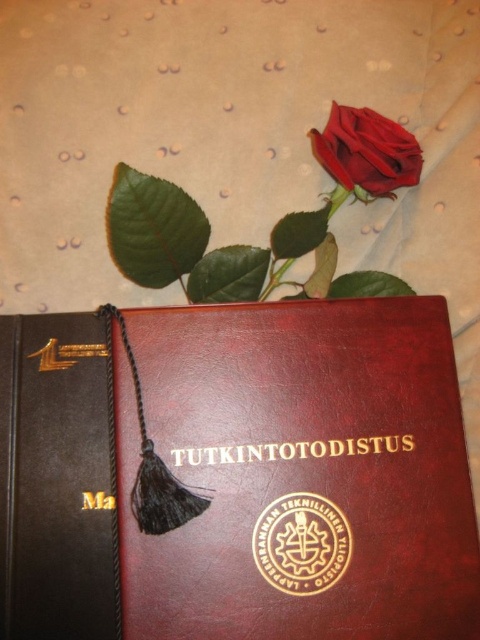
Is point (283, 621) more distant than point (330, 147)?

No.

Is brown leather book at center to the right of matte red rose at upper center from the viewer's perspective?

In fact, brown leather book at center is to the left of matte red rose at upper center.

Does point (41, 580) come farther from viewer compared to point (368, 144)?

That is False.

This screenshot has width=480, height=640. I want to click on brown leather book at center, so click(238, 474).